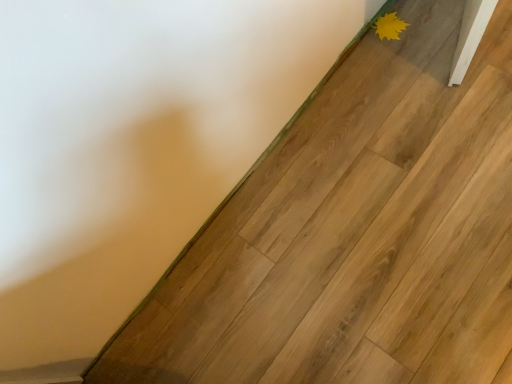
Where is `vacant area that is situated to the right of yellow matte maple leaf at upper right`? vacant area that is situated to the right of yellow matte maple leaf at upper right is located at coordinates tap(429, 16).